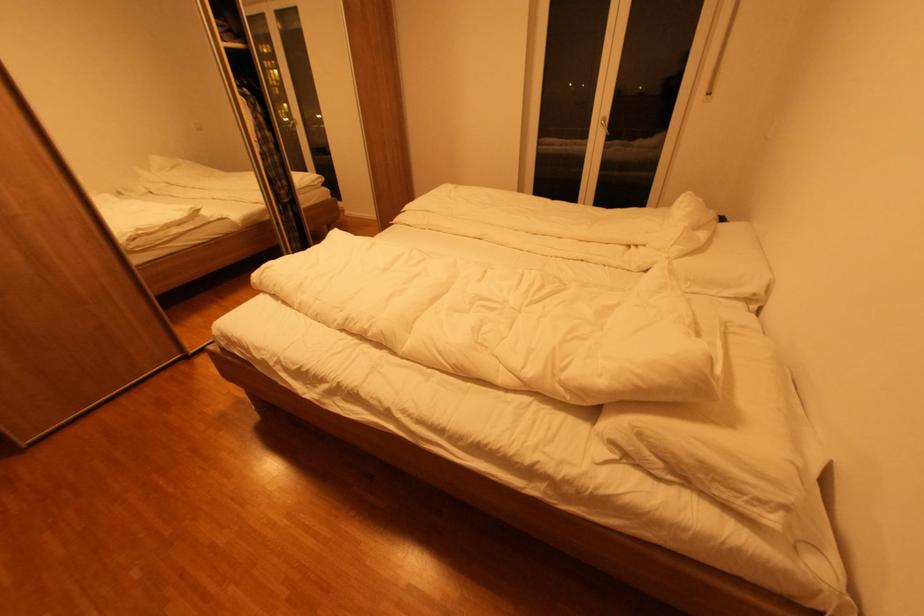
The image size is (924, 616). Identify the location of white window handle. (718, 44).